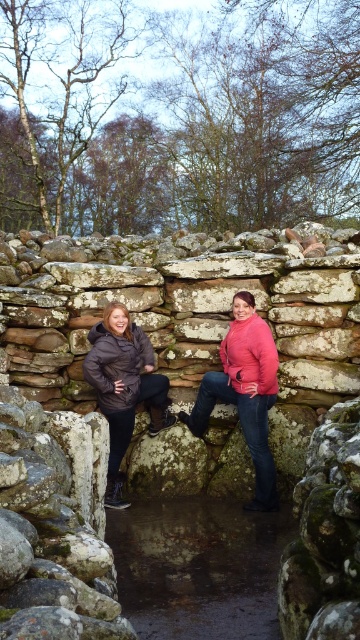
Based on the photo, you are a photographer trying to frame a shot that includes both the matte black jacket at center and the matte brown jacket at center. Since you want both jackets to appear equally prominent in the photo, which jacket should you move closer to the camera?

The matte black jacket at center is much taller than the matte brown jacket at center. To make them appear equally prominent, move the matte black jacket at center further away from the camera and bring the matte brown jacket at center closer. This way, their sizes in the frame will balance out.

You are standing in front of an ancient stone wall and see two people wearing jackets. One has a matte black jacket at center and the other a matte brown jacket at center. If you want to take a photo of the person closer to you, which jacket should you focus on?

The matte black jacket at center is closer to the viewer, so you should focus on the matte black jacket at center to take a photo of the person closer to you.